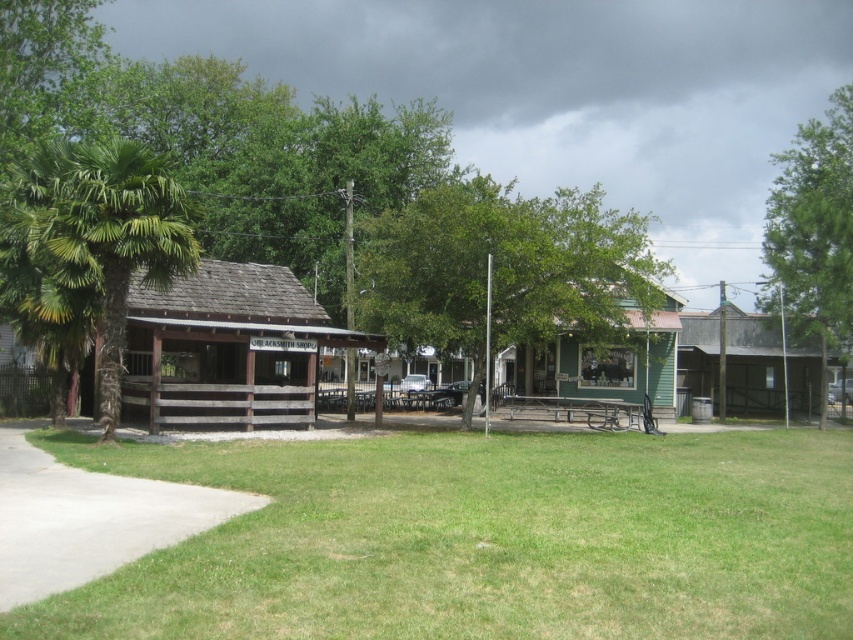
Between green grass at center and wooden hut at center, which one is positioned higher?

wooden hut at center is higher up.

Who is lower down, green grass at center or wooden hut at center?

Positioned lower is green grass at center.

The height and width of the screenshot is (640, 853). I want to click on green grass at center, so click(x=485, y=540).

Who is positioned more to the left, wooden hut at center or green wood picnic table at center?

From the viewer's perspective, wooden hut at center appears more on the left side.

Which is in front, point (312, 396) or point (550, 353)?

Point (312, 396)

Where is `wooden hut at center`? The height and width of the screenshot is (640, 853). wooden hut at center is located at coordinates (228, 348).

Is wooden hut at center to the right of green leafy tree at upper right from the viewer's perspective?

No, wooden hut at center is not to the right of green leafy tree at upper right.

Measure the distance between wooden hut at center and green leafy tree at upper right.

wooden hut at center is 20.97 meters from green leafy tree at upper right.

Who is more distant from viewer, (289,272) or (775,259)?

Point (775,259)

Where is `wooden hut at center`? Image resolution: width=853 pixels, height=640 pixels. wooden hut at center is located at coordinates (228, 348).